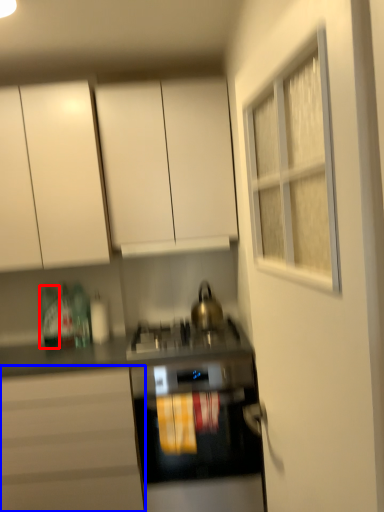
Question: Which point is closer to the camera, bottle (highlighted by a red box) or cabinetry (highlighted by a blue box)?

Choices:
 (A) bottle
 (B) cabinetry

Answer: (B)